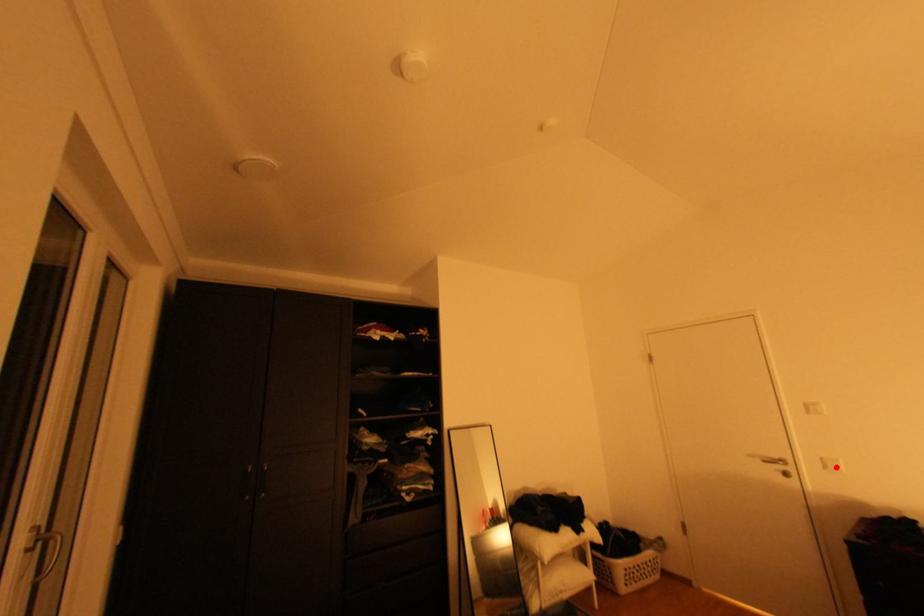
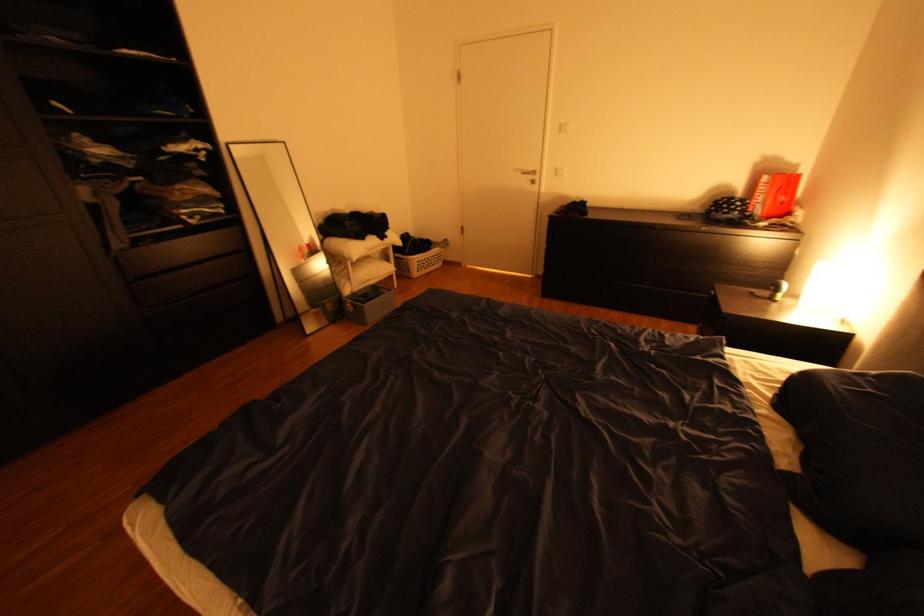
In the second image, find the point that corresponds to the highlighted location in the first image.

(565, 174)